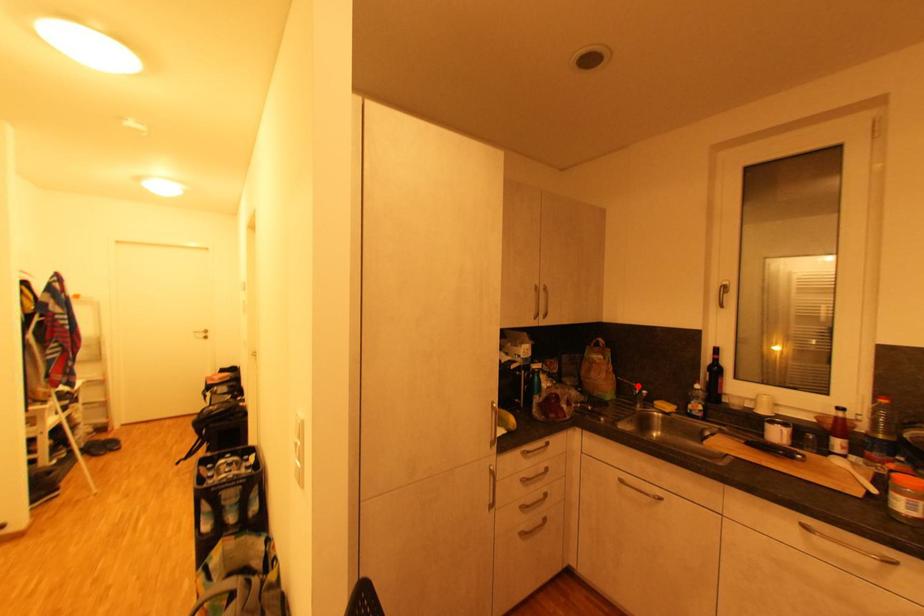
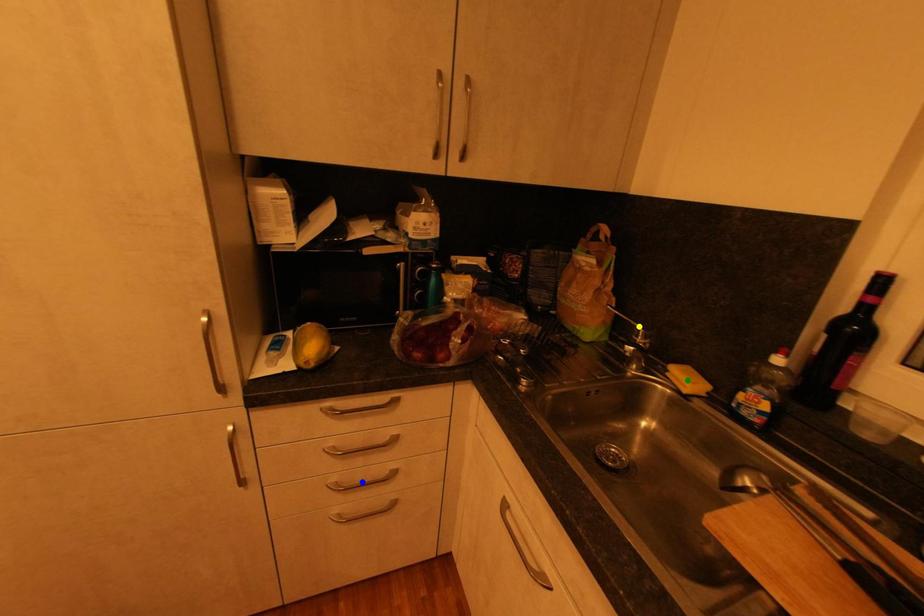
Question: I am providing you with two images of the same scene from different viewpoints. A red point is marked on the first image. You are given multiple points on the second image. Which mark in image 2 goes with the point in image 1?

Choices:
 (A) yellow point
 (B) green point
 (C) blue point

Answer: (A)